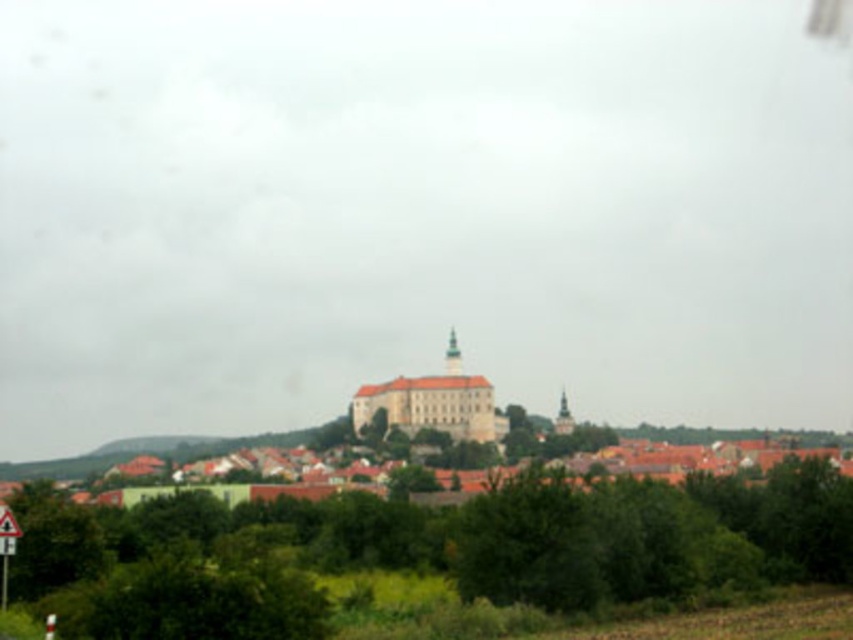
You are an architect analyzing the layout of the castle and town. Given the coordinates provided for the white stone town at center, can you determine its position relative to the castle?

The white stone town at center is located at point coordinates, which places it centrally positioned in the image, likely surrounded by the castle and other structures.

You are standing at the base of the hill where the historic castle is located. You see the white stone town at center and the white plastic triangle at lower left. Which object is positioned more to the left side of the image?

The white plastic triangle at lower left is positioned more to the left side of the image compared to the white stone town at center.

You are an architect analyzing the layout of the castle and town. Based on the image, which object is positioned higher in the scene, the white stone town at center or the white plastic triangle at lower left?

The white stone town at center is positioned above the white plastic triangle at lower left, so the white stone town at center is higher in the scene.